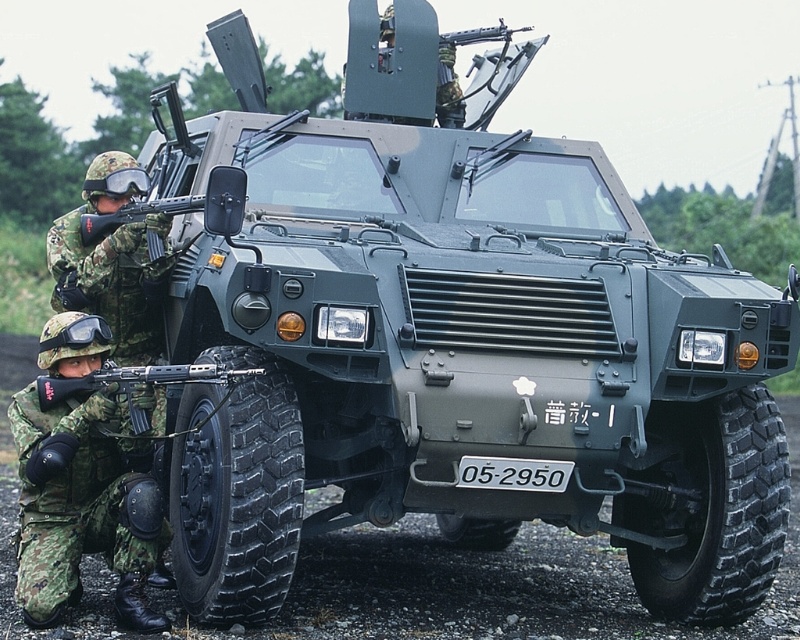
Which is more to the left, black matte rifle at lower left or white plastic license plate at center?

black matte rifle at lower left

Identify the location of black matte rifle at lower left. The width and height of the screenshot is (800, 640). (140, 387).